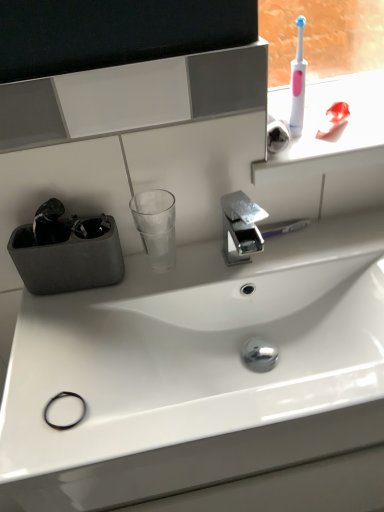
Question: Does point (331, 90) appear closer or farther from the camera than point (302, 99)?

Choices:
 (A) farther
 (B) closer

Answer: (A)

Question: In the image, is pink plastic toothbrush at upper right positioned in front of or behind white plastic toothbrush at upper right?

Choices:
 (A) behind
 (B) front

Answer: (A)

Question: Which object is the closest to the transparent glass at center?

Choices:
 (A) white glossy sink at center
 (B) pink plastic toothbrush at upper right
 (C) white plastic toothbrush at upper right
 (D) polished chrome tap at center

Answer: (D)

Question: Considering the real-world distances, which object is farthest from the pink plastic toothbrush at upper right?

Choices:
 (A) white glossy sink at center
 (B) polished chrome tap at center
 (C) transparent glass at center
 (D) white plastic toothbrush at upper right

Answer: (C)